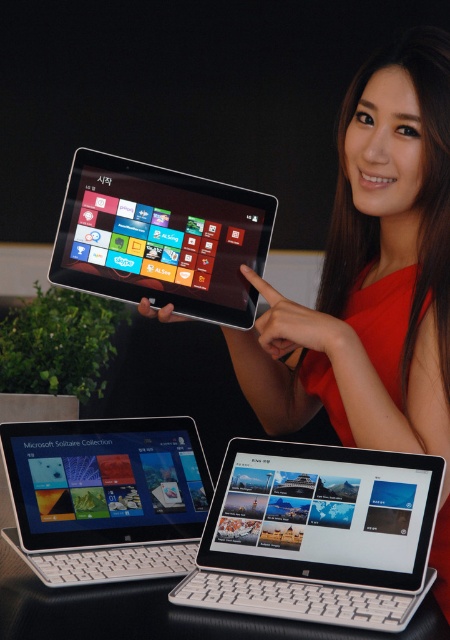
Question: Which of the following is the farthest from the observer?

Choices:
 (A) (199, 180)
 (B) (343, 625)

Answer: (A)

Question: Which point is farther from the camera taking this photo?

Choices:
 (A) (90, 481)
 (B) (135, 244)
 (C) (365, 572)

Answer: (B)

Question: Considering the relative positions of white plastic tablet at center and matte black laptop at center in the image provided, where is white plastic tablet at center located with respect to matte black laptop at center?

Choices:
 (A) above
 (B) below

Answer: (B)

Question: Which of the following is the closest to the observer?

Choices:
 (A) (280, 486)
 (B) (169, 180)

Answer: (A)

Question: Where is white plastic tablet at center located in relation to matte black tablet at center in the image?

Choices:
 (A) below
 (B) above

Answer: (A)

Question: Does white plastic tablet at center have a lesser width compared to matte black laptop at center?

Choices:
 (A) yes
 (B) no

Answer: (B)